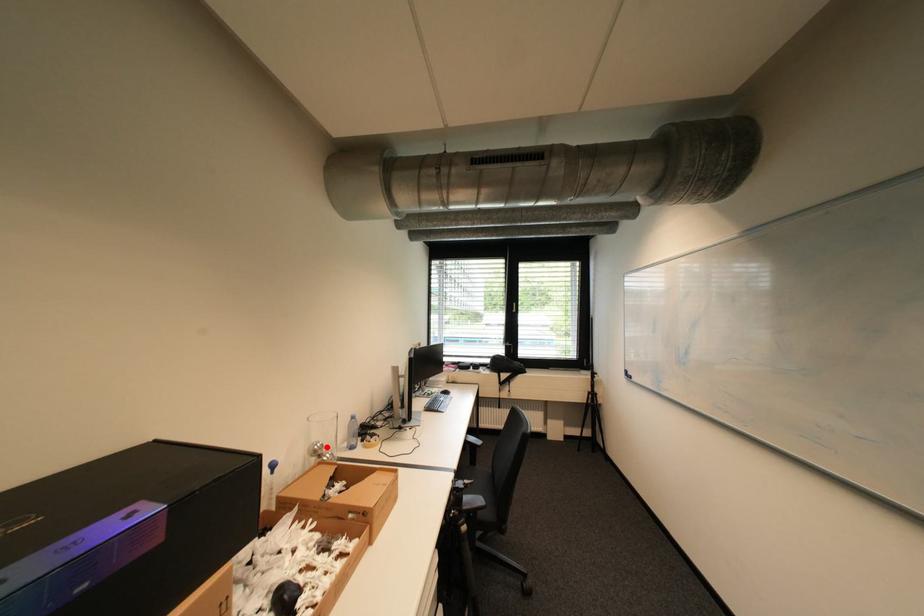
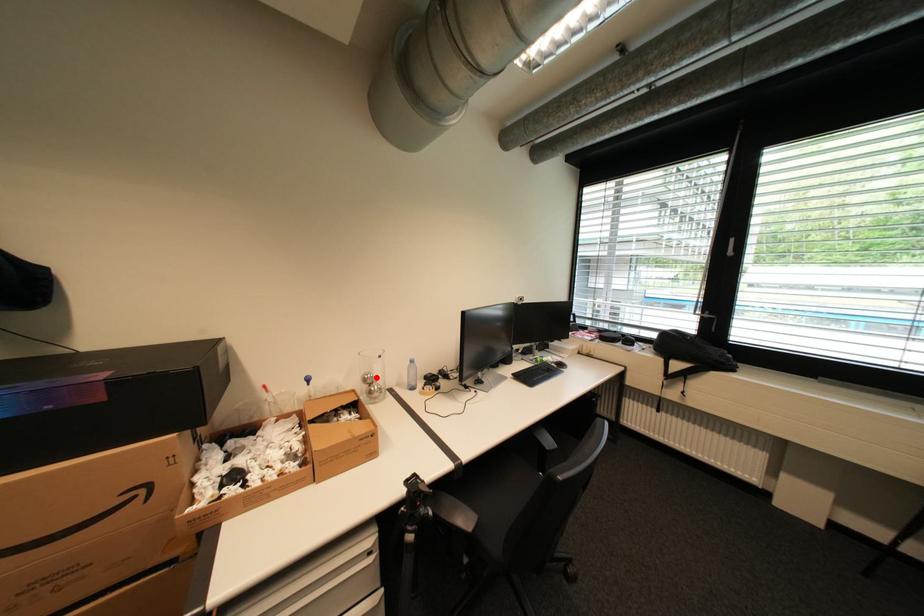
I am providing you with two images of the same scene from different viewpoints. A red point is marked on the first image and another point is marked on the second image. Do the highlighted points in image1 and image2 indicate the same real-world spot?

Yes